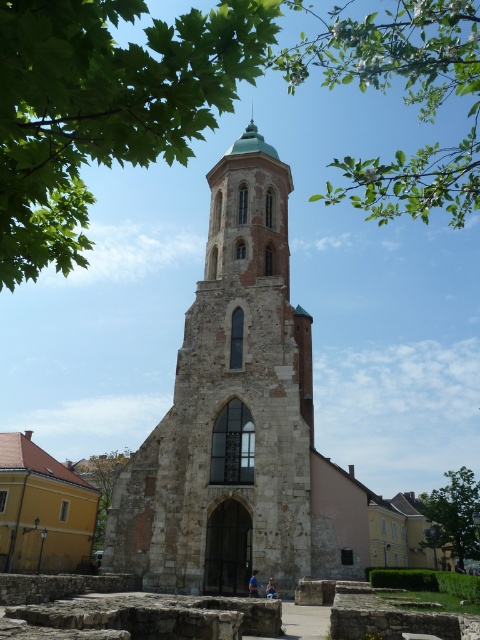
Question: From the image, what is the correct spatial relationship of green leafy tree at upper center in relation to green leafy tree at lower left?

Choices:
 (A) right
 (B) left

Answer: (A)

Question: Does green leafy tree at lower right appear over green leafy tree at lower left?

Choices:
 (A) yes
 (B) no

Answer: (B)

Question: Which object is positioned closest to the yellow matte building at lower left?

Choices:
 (A) stone church at center
 (B) green leafy tree at lower right

Answer: (A)

Question: Which object is positioned closest to the green leafy tree at upper center?

Choices:
 (A) green leafy tree at lower right
 (B) green leafy tree at lower left
 (C) stone church at center
 (D) yellow matte building at lower left

Answer: (C)

Question: Does green leafy tree at upper center lie behind yellow matte building at lower left?

Choices:
 (A) yes
 (B) no

Answer: (B)

Question: Which object is closer to the camera taking this photo?

Choices:
 (A) yellow matte building at lower left
 (B) green leafy tree at lower right

Answer: (A)